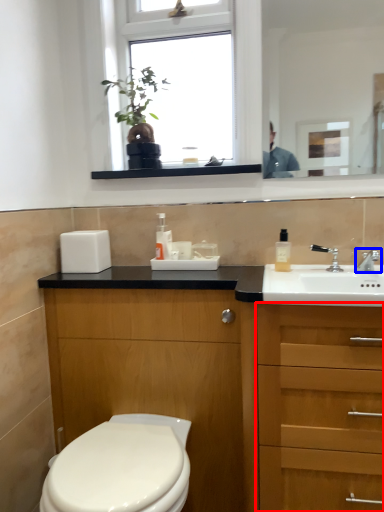
Question: Which point is further to the camera, cabinetry (highlighted by a red box) or tap (highlighted by a blue box)?

Choices:
 (A) cabinetry
 (B) tap

Answer: (B)